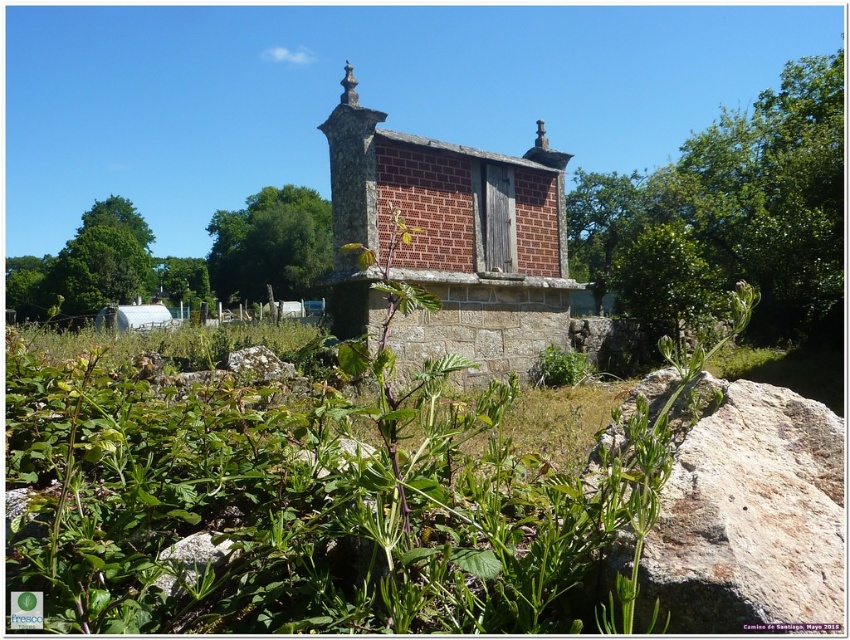
You are standing in front of the brown brick church at center and want to look up at the green leafy tree at center. Which direction should you move to get a better view?

The brown brick church at center is located below the green leafy tree at center, so you should move forward to get a better view.

You are standing in front of the rustic stone building and notice a point marked at coordinates (729, 214). Which object does this point indicate?

The point at (729, 214) marks the green leafy tree at upper center.